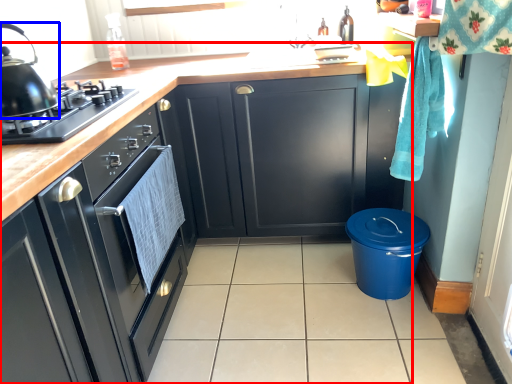
Question: Which point is further to the camera, cabinetry (highlighted by a red box) or kitchen appliance (highlighted by a blue box)?

Choices:
 (A) cabinetry
 (B) kitchen appliance

Answer: (B)